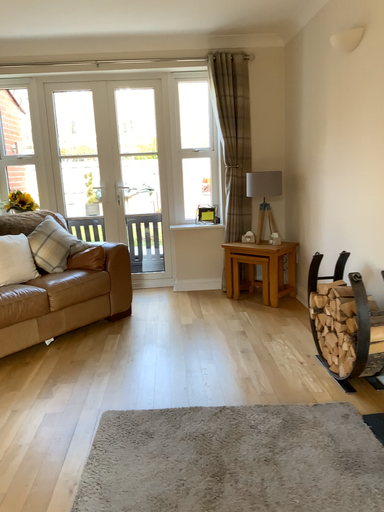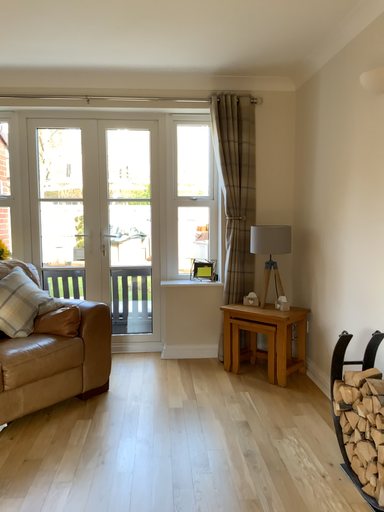
Question: How did the camera likely rotate when shooting the video?

Choices:
 (A) rotated upward
 (B) rotated downward

Answer: (A)